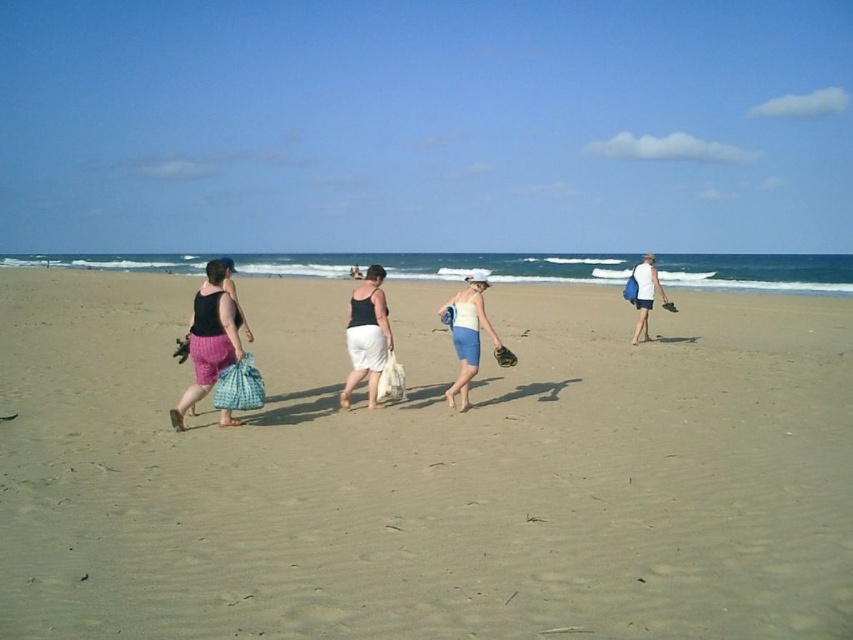
Looking at this image, you are standing at the beach and see the light brown sand at center and the white fabric shorts at right. Which object is nearer to you?

The light brown sand at center is closer to the viewer than the white fabric shorts at right.

You are standing on the beach and want to place a small flag in the sand. The flag pole is 1 foot long. Considering the light brown sand at center and the matte pink shorts at left, which object can the flag be placed into without the pole hitting the other object?

The flag pole can be placed into the light brown sand at center because it is taller than the matte pink shorts at left, so the pole will not hit the shorts.

You are standing at the point marked by the coordinates point (426, 472) on the beach. Looking around, you see light brown sand at center. Which direction should you walk to reach the ocean?

Since the point (426, 472) represents the light brown sand at center and the ocean is at the horizon where the waves meet the shore, you should walk towards the direction of the ocean, which is away from the camera. However, without specific spatial relations in the Objects Description, the exact direction can only be inferred based on typical beach layouts where the ocean is usually in front of the foreground elements. Therefore, walk forward from the point towards the horizon.